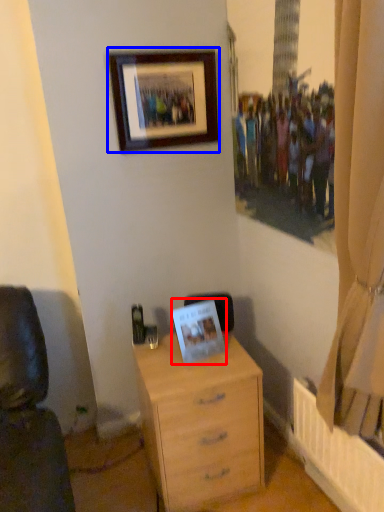
Question: Which of the following is the closest to the observer, picture frame (highlighted by a red box) or picture frame (highlighted by a blue box)?

Choices:
 (A) picture frame
 (B) picture frame

Answer: (A)